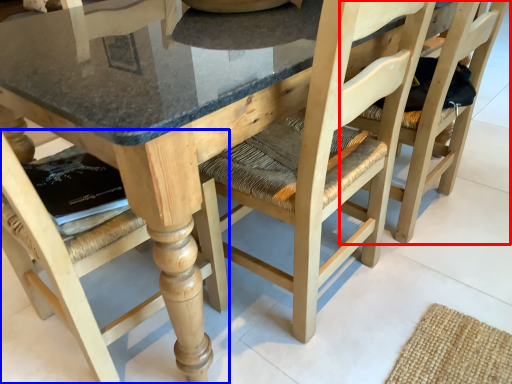
Question: Which of the following is the farthest to the observer, chair (highlighted by a red box) or chair (highlighted by a blue box)?

Choices:
 (A) chair
 (B) chair

Answer: (A)